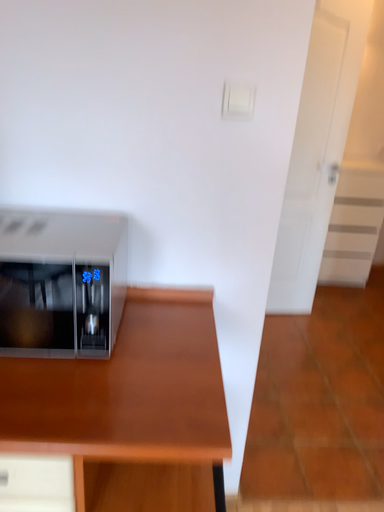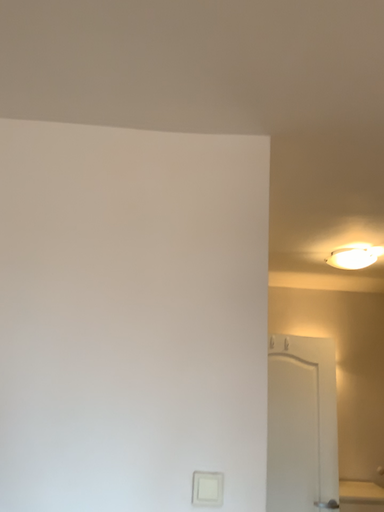
Question: How did the camera likely rotate when shooting the video?

Choices:
 (A) rotated upward
 (B) rotated downward

Answer: (A)